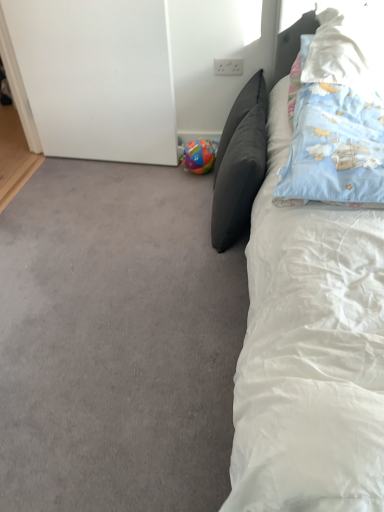
Question: Is white soft bed at right far from dark gray cushion at center, positioned as the third pillow in right-to-left order?

Choices:
 (A) no
 (B) yes

Answer: (A)

Question: Is white soft bed at right aimed at dark gray cushion at center, positioned as the third pillow in right-to-left order?

Choices:
 (A) yes
 (B) no

Answer: (B)

Question: Is white soft bed at right to the left of dark gray cushion at center, positioned as the third pillow in right-to-left order, from the viewer's perspective?

Choices:
 (A) yes
 (B) no

Answer: (B)

Question: Is the depth of white soft bed at right greater than that of dark gray cushion at center, which is counted as the first pillow, starting from the left?

Choices:
 (A) no
 (B) yes

Answer: (A)

Question: Is white soft bed at right looking in the opposite direction of dark gray cushion at center, which is counted as the first pillow, starting from the left?

Choices:
 (A) yes
 (B) no

Answer: (B)

Question: Considering the relative sizes of white soft bed at right and dark gray cushion at center, positioned as the third pillow in right-to-left order, in the image provided, is white soft bed at right bigger than dark gray cushion at center, positioned as the third pillow in right-to-left order,?

Choices:
 (A) yes
 (B) no

Answer: (A)

Question: Is blue cotton pillow at upper right, acting as the second pillow starting from the left, turned away from dark gray cushion at center, which is counted as the first pillow, starting from the left?

Choices:
 (A) yes
 (B) no

Answer: (B)

Question: Are blue cotton pillow at upper right, acting as the second pillow starting from the left, and dark gray cushion at center, which is counted as the first pillow, starting from the left, far apart?

Choices:
 (A) no
 (B) yes

Answer: (A)

Question: Considering the relative sizes of blue cotton pillow at upper right, acting as the second pillow starting from the left, and dark gray cushion at center, which is counted as the first pillow, starting from the left, in the image provided, is blue cotton pillow at upper right, acting as the second pillow starting from the left, thinner than dark gray cushion at center, which is counted as the first pillow, starting from the left,?

Choices:
 (A) no
 (B) yes

Answer: (A)

Question: From a real-world perspective, is blue cotton pillow at upper right, which is the 2th pillow from right to left, under dark gray cushion at center, positioned as the third pillow in right-to-left order?

Choices:
 (A) yes
 (B) no

Answer: (B)

Question: From the image's perspective, is blue cotton pillow at upper right, acting as the second pillow starting from the left, below dark gray cushion at center, positioned as the third pillow in right-to-left order?

Choices:
 (A) no
 (B) yes

Answer: (A)

Question: Is blue cotton pillow at upper right, acting as the second pillow starting from the left, aimed at dark gray cushion at center, which is counted as the first pillow, starting from the left?

Choices:
 (A) no
 (B) yes

Answer: (A)

Question: Is multicolored plastic ball at lower left oriented away from gray carpet at lower left?

Choices:
 (A) yes
 (B) no

Answer: (B)